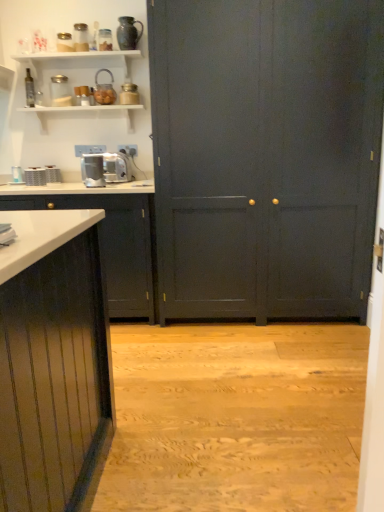
Question: From a real-world perspective, is brushed metal toaster at left, positioned as the second appliance in left-to-right order, located beneath metallic silver toaster at upper center, which ranks as the 1th appliance in right-to-left order?

Choices:
 (A) yes
 (B) no

Answer: (A)

Question: Is brushed metal toaster at left, positioned as the second appliance in left-to-right order, to the right of metallic silver toaster at upper center, which ranks as the 1th appliance in right-to-left order, from the viewer's perspective?

Choices:
 (A) yes
 (B) no

Answer: (B)

Question: From the image's perspective, does brushed metal toaster at left, positioned as the second appliance in left-to-right order, appear lower than metallic silver toaster at upper center, which ranks as the 1th appliance in right-to-left order?

Choices:
 (A) yes
 (B) no

Answer: (A)

Question: Is brushed metal toaster at left, positioned as the second appliance in left-to-right order, not near metallic silver toaster at upper center, which ranks as the 1th appliance in right-to-left order?

Choices:
 (A) no
 (B) yes

Answer: (A)

Question: Is brushed metal toaster at left, positioned as the second appliance in left-to-right order, bigger than metallic silver toaster at upper center, which is counted as the seventh appliance, starting from the left?

Choices:
 (A) no
 (B) yes

Answer: (B)

Question: Considering the relative sizes of brushed metal toaster at left, positioned as the second appliance in left-to-right order, and metallic silver toaster at upper center, which is counted as the seventh appliance, starting from the left, in the image provided, is brushed metal toaster at left, positioned as the second appliance in left-to-right order, shorter than metallic silver toaster at upper center, which is counted as the seventh appliance, starting from the left,?

Choices:
 (A) yes
 (B) no

Answer: (A)

Question: Is brushed metal toaster at left, positioned as the second appliance in left-to-right order, closer to the viewer compared to white glossy countertop at left?

Choices:
 (A) no
 (B) yes

Answer: (A)

Question: From the image's perspective, is brushed metal toaster at left, which is the sixth appliance in right-to-left order, located beneath white glossy countertop at left?

Choices:
 (A) yes
 (B) no

Answer: (B)

Question: Is brushed metal toaster at left, which is the sixth appliance in right-to-left order, not within white glossy countertop at left?

Choices:
 (A) yes
 (B) no

Answer: (B)

Question: Is brushed metal toaster at left, positioned as the second appliance in left-to-right order, aimed at white glossy countertop at left?

Choices:
 (A) no
 (B) yes

Answer: (B)

Question: Is brushed metal toaster at left, which is the sixth appliance in right-to-left order, placed right next to white glossy countertop at left?

Choices:
 (A) yes
 (B) no

Answer: (B)

Question: Is brushed metal toaster at left, which is the sixth appliance in right-to-left order, further to the viewer compared to white glossy countertop at left?

Choices:
 (A) no
 (B) yes

Answer: (B)

Question: Could you tell me if clear glass jar at upper left, the 4th appliance from the right, is facing brushed metal toaster at left, positioned as the second appliance in left-to-right order?

Choices:
 (A) yes
 (B) no

Answer: (B)